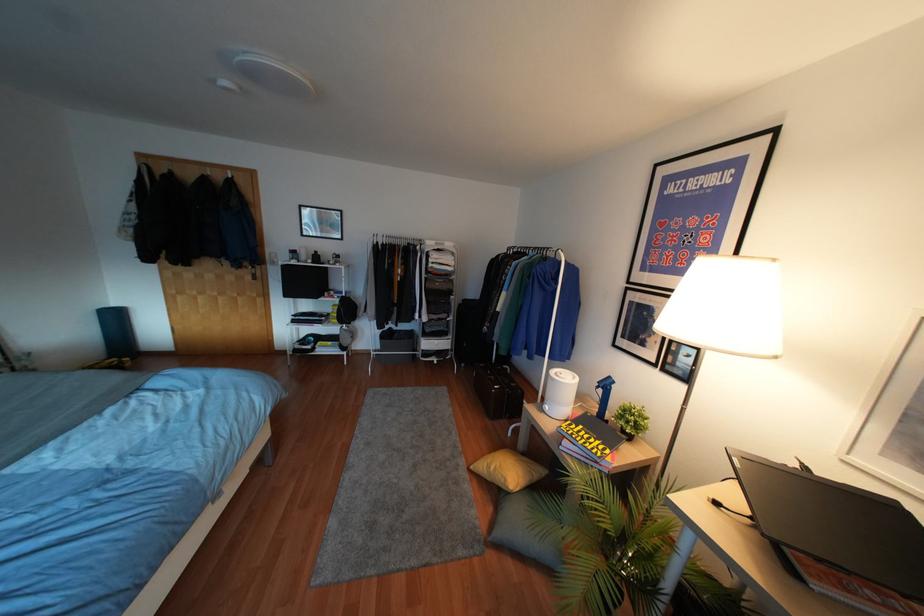
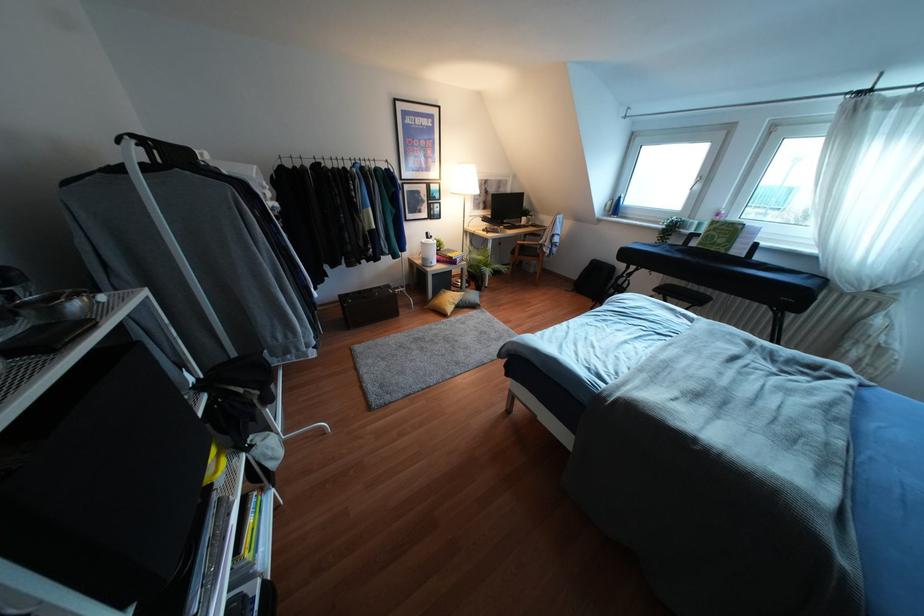
Find the pixel in the second image that matches the point at 609,377 in the first image.

(427, 233)